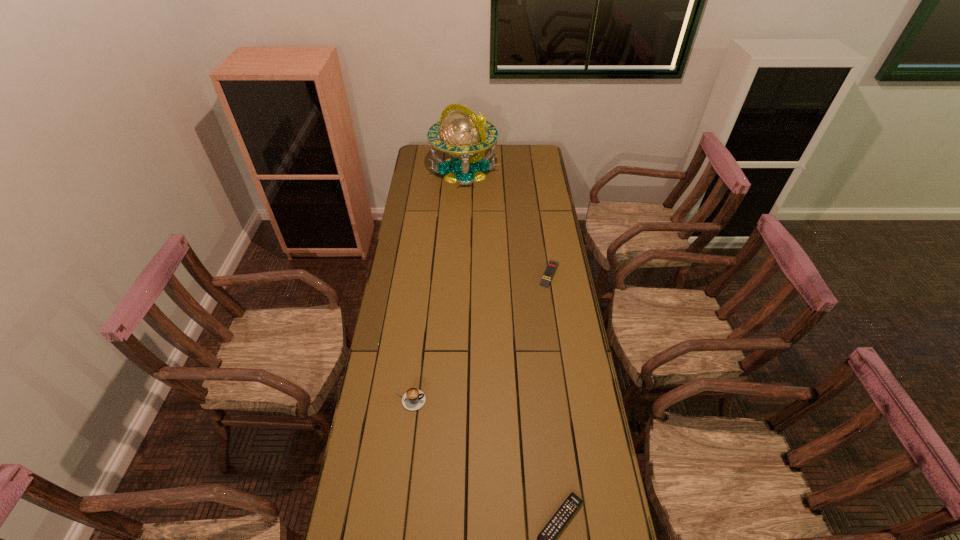
Where is `globe`? This screenshot has width=960, height=540. globe is located at coordinates (462, 133).

Find the location of a particular element. the tallest object is located at coordinates (462, 133).

The height and width of the screenshot is (540, 960). What are the coordinates of `cappuccino` in the screenshot? It's located at (413, 399).

This screenshot has width=960, height=540. In order to click on the third farthest object in this screenshot , I will do `click(413, 399)`.

Identify the location of the third nearest object. The image size is (960, 540). [x=552, y=265].

Identify the location of the farther remote control. The image size is (960, 540). (552, 265).

Where is `vacant space located on the left of the tallest object`? The height and width of the screenshot is (540, 960). vacant space located on the left of the tallest object is located at coordinates (418, 171).

Find the location of `free space located with the handle on the side of the second tallest object`. free space located with the handle on the side of the second tallest object is located at coordinates (540, 400).

Identify the location of free location located on the back of the third nearest object. pos(543,232).

In order to click on object that is at the far edge in this screenshot , I will do `click(462, 133)`.